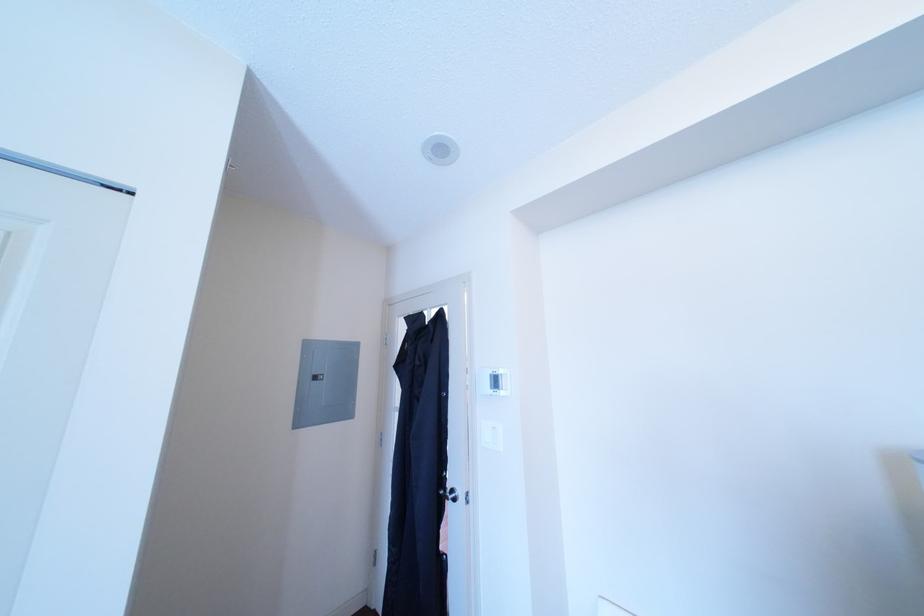
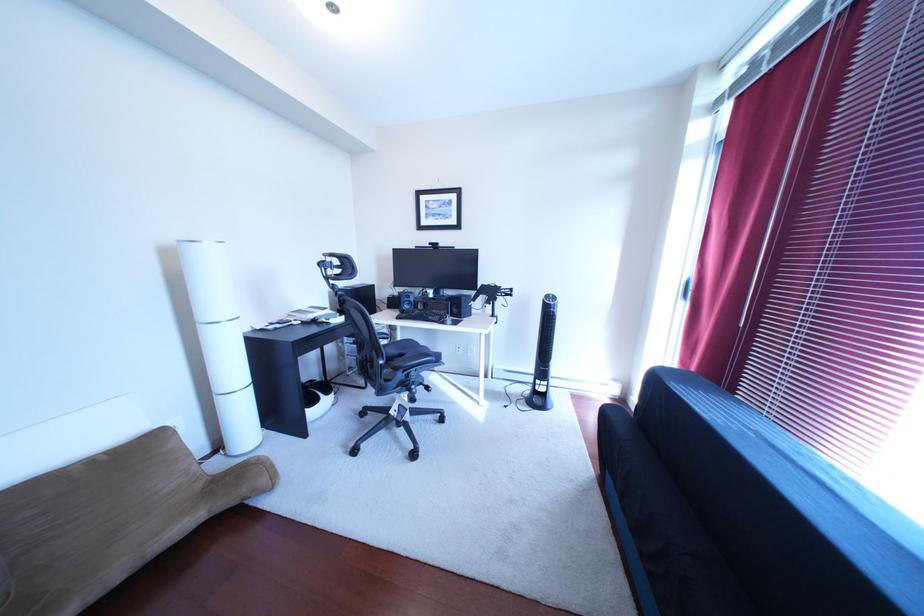
Question: The camera is either moving clockwise (left) or counter-clockwise (right) around the object. The first image is from the beginning of the video and the second image is from the end. Is the camera moving left or right when shooting the video?

Choices:
 (A) Left
 (B) Right

Answer: (A)